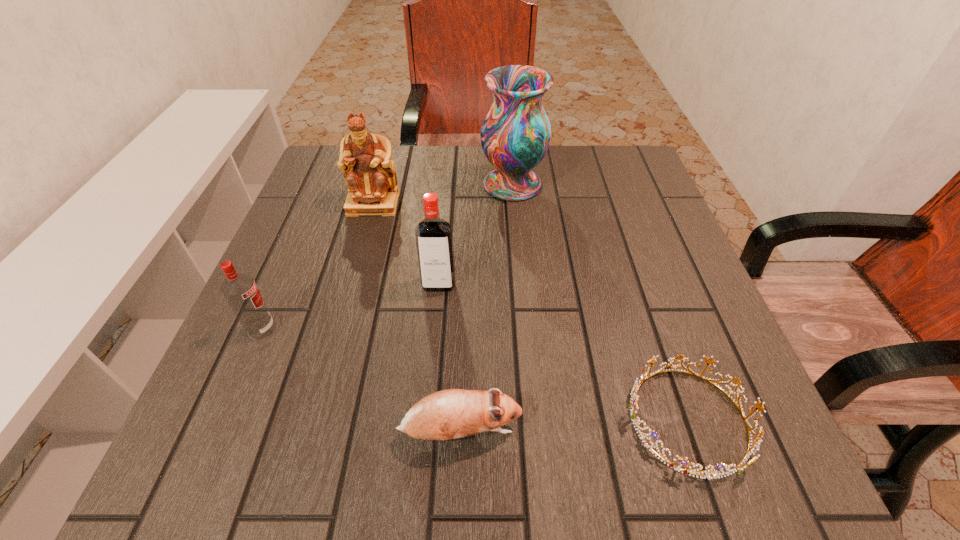
Where is `free space located 0.310m on the front-facing side of the second object from left to right`? free space located 0.310m on the front-facing side of the second object from left to right is located at coordinates (340, 323).

I want to click on vacant region located 0.080m on the front and back of the right vodka, so click(435, 326).

Where is `vacant region located 0.190m on the front label of the shorter vodka`? This screenshot has height=540, width=960. vacant region located 0.190m on the front label of the shorter vodka is located at coordinates (382, 329).

Locate an element on the screen. Image resolution: width=960 pixels, height=540 pixels. free region located at the face of the second shortest object is located at coordinates (656, 432).

In order to click on vacant space located 0.060m on the front-facing side of the tiara in this screenshot , I will do tap(587, 420).

The width and height of the screenshot is (960, 540). What are the coordinates of `vacant area situated 0.160m on the front-facing side of the tiara` in the screenshot? It's located at (520, 420).

You are a GUI agent. You are given a task and a screenshot of the screen. Output one action in this format:
    pyautogui.click(x=<x>, y=<y>)
    Task: Click on the vacant area located on the front-facing side of the tiara
    This screenshot has height=540, width=960.
    Given the screenshot: What is the action you would take?
    pyautogui.click(x=455, y=420)

Find the location of a particular element. This screenshot has width=960, height=540. vase located in the far edge section of the desktop is located at coordinates (515, 134).

Where is `figurine located in the far edge section of the desktop`? This screenshot has height=540, width=960. figurine located in the far edge section of the desktop is located at coordinates (365, 158).

At what (x,y) coordinates should I click in order to perform the action: click on hamster that is positioned at the near edge. Please return your answer as a coordinate pair (x, y). Looking at the image, I should click on (452, 413).